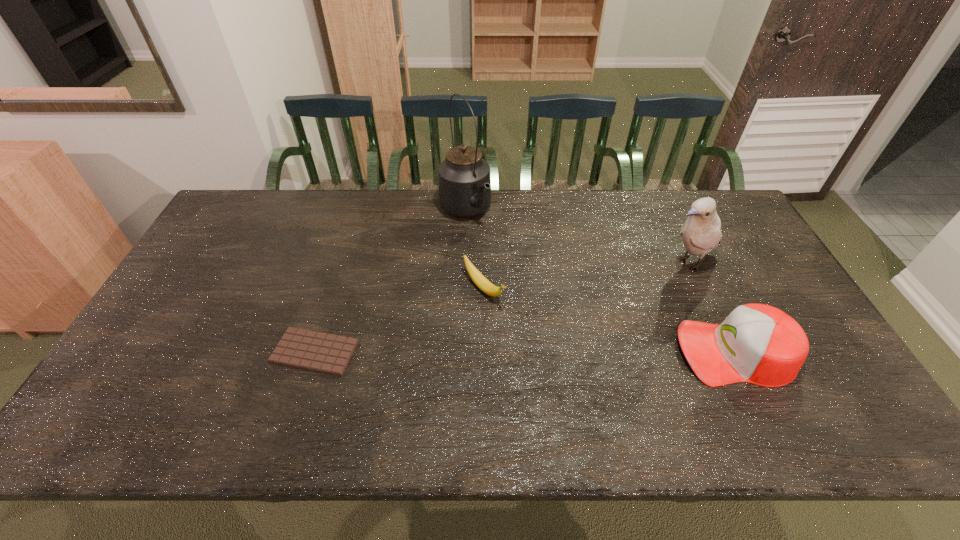
Find the location of a particular element. This screenshot has width=960, height=540. vacant space on the desktop that is between the shortest object and the baseball cap and is positioned at the stem of the fourth tallest object is located at coordinates (548, 352).

Find the location of a particular element. The width and height of the screenshot is (960, 540). vacant space on the desktop that is between the shortest object and the third tallest object and is positioned at the beak of the bird is located at coordinates (516, 352).

Identify the location of vacant space on the desktop that is between the leftmost object and the baseball cap and is positioned spout on the kettle. Image resolution: width=960 pixels, height=540 pixels. (584, 352).